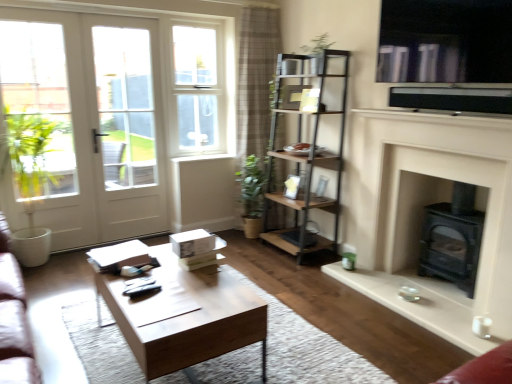
Question: Does plaid fabric curtain at upper center have a larger size compared to white glass screen door at left?

Choices:
 (A) yes
 (B) no

Answer: (A)

Question: Is plaid fabric curtain at upper center far from white glass screen door at left?

Choices:
 (A) yes
 (B) no

Answer: (A)

Question: Considering the relative sizes of plaid fabric curtain at upper center and white glass screen door at left in the image provided, is plaid fabric curtain at upper center taller than white glass screen door at left?

Choices:
 (A) yes
 (B) no

Answer: (A)

Question: From the image's perspective, is plaid fabric curtain at upper center on top of white glass screen door at left?

Choices:
 (A) no
 (B) yes

Answer: (B)

Question: Is plaid fabric curtain at upper center outside of white glass screen door at left?

Choices:
 (A) no
 (B) yes

Answer: (B)

Question: Could you tell me if plaid fabric curtain at upper center is turned towards white glass screen door at left?

Choices:
 (A) no
 (B) yes

Answer: (A)

Question: Is white plastic window at upper center positioned with its back to plaid fabric curtain at upper center?

Choices:
 (A) yes
 (B) no

Answer: (B)

Question: Could you tell me if white plastic window at upper center is facing plaid fabric curtain at upper center?

Choices:
 (A) yes
 (B) no

Answer: (B)

Question: Considering the relative positions of white plastic window at upper center and plaid fabric curtain at upper center in the image provided, is white plastic window at upper center in front of plaid fabric curtain at upper center?

Choices:
 (A) no
 (B) yes

Answer: (A)

Question: Would you say white plastic window at upper center is outside plaid fabric curtain at upper center?

Choices:
 (A) yes
 (B) no

Answer: (A)

Question: From a real-world perspective, is white plastic window at upper center over plaid fabric curtain at upper center?

Choices:
 (A) yes
 (B) no

Answer: (A)

Question: Is white plastic window at upper center far away from plaid fabric curtain at upper center?

Choices:
 (A) yes
 (B) no

Answer: (B)

Question: From a real-world perspective, does metallic brown shelf at center stand above black matte wood burning stove at lower right?

Choices:
 (A) no
 (B) yes

Answer: (B)